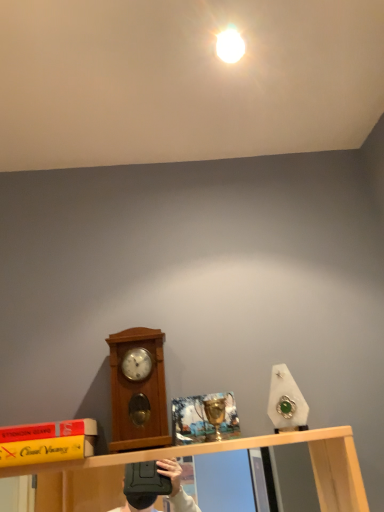
You are a GUI agent. You are given a task and a screenshot of the screen. Output one action in this format:
    pyautogui.click(x=<x>, y=<y>)
    Task: Click on the vacant region to the right of white glossy light bulb at upper center
    This screenshot has width=384, height=512.
    Given the screenshot: What is the action you would take?
    pyautogui.click(x=302, y=51)